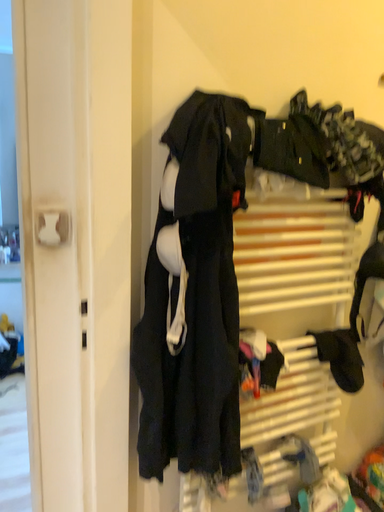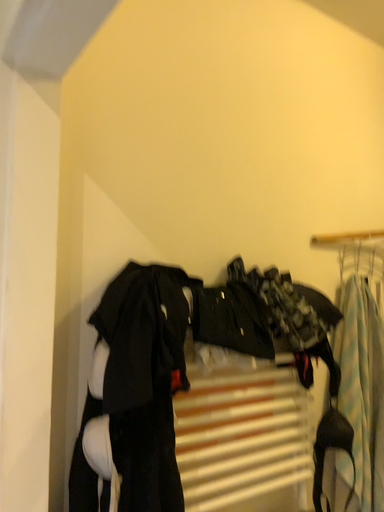
Question: Which way did the camera rotate in the video?

Choices:
 (A) rotated upward
 (B) rotated downward

Answer: (A)